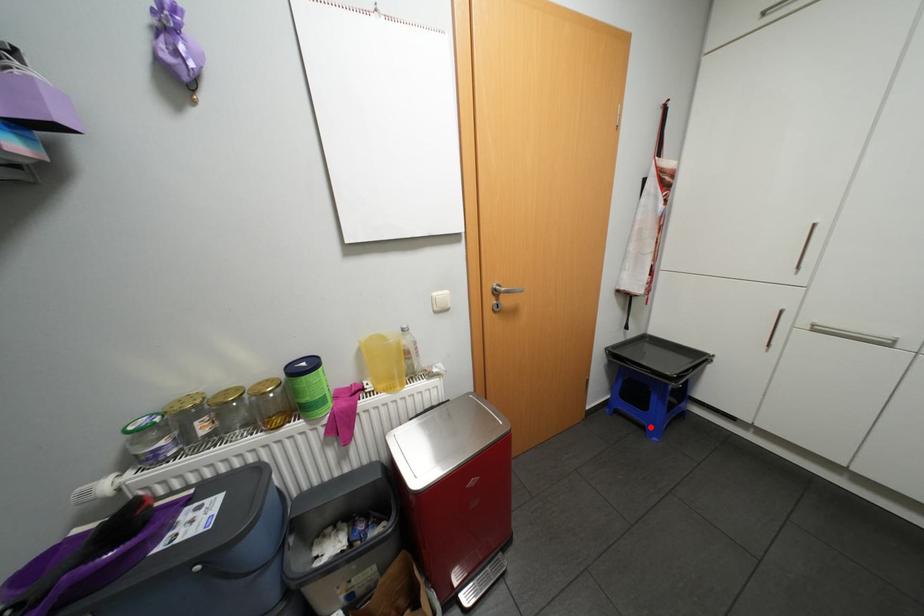
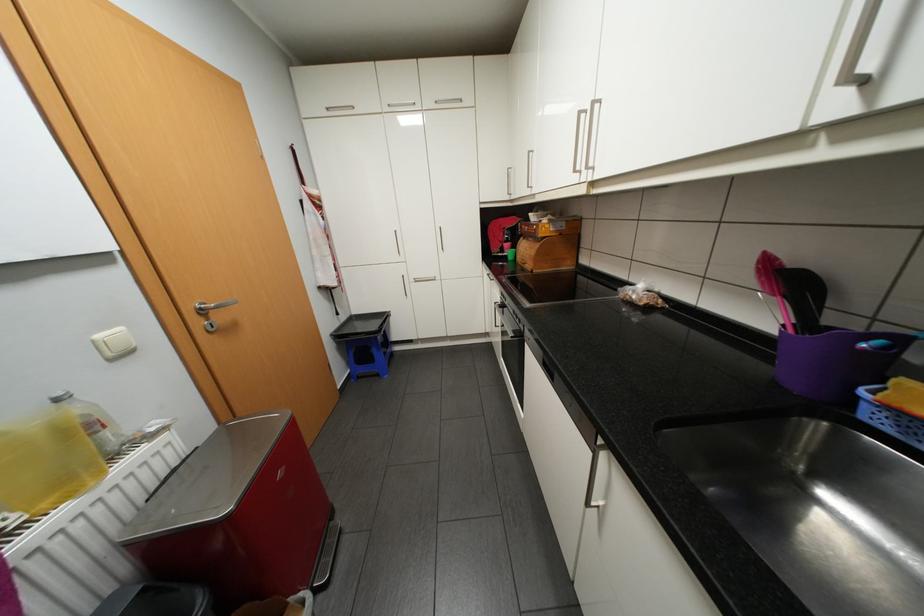
Question: A red point is marked in image1. In image2, is the corresponding 3D point closer to the camera or farther? Reply with the corresponding letter.

Choices:
 (A) The corresponding 3D point is closer.
 (B) The corresponding 3D point is farther.

Answer: (B)